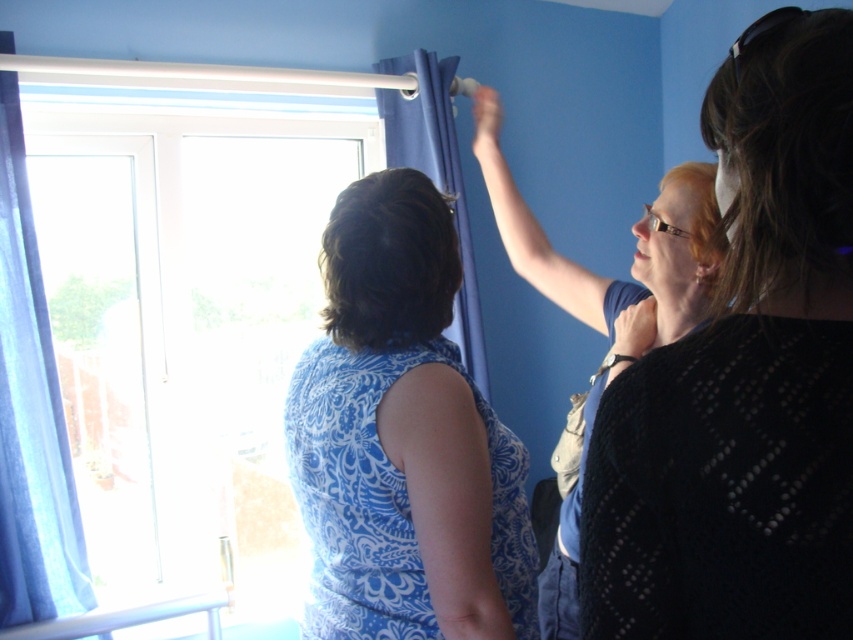
Question: Can you confirm if blue printed dress at center is bigger than blue fabric curtain at left?

Choices:
 (A) yes
 (B) no

Answer: (A)

Question: Among these objects, which one is nearest to the camera?

Choices:
 (A) matte blue dress at center
 (B) matte blue dress at upper center
 (C) matte blue curtain at upper center

Answer: (A)

Question: Can you confirm if blue printed dress at center is wider than blue fabric curtain at left?

Choices:
 (A) no
 (B) yes

Answer: (B)

Question: Which point is farther from the camera taking this photo?

Choices:
 (A) (810, 384)
 (B) (608, 330)

Answer: (B)

Question: Can you confirm if blue printed dress at center is thinner than blue fabric curtain at left?

Choices:
 (A) no
 (B) yes

Answer: (A)

Question: Which point is closer to the camera taking this photo?

Choices:
 (A) (479, 134)
 (B) (445, 104)
 (C) (810, 372)
 (D) (49, 506)

Answer: (C)